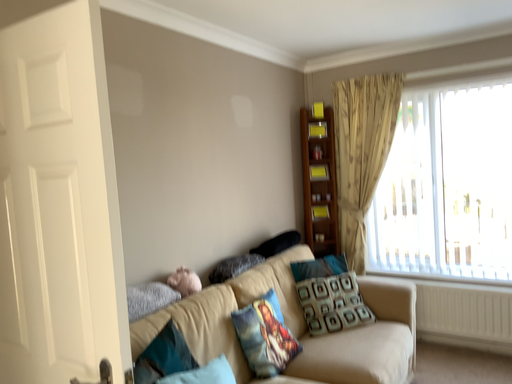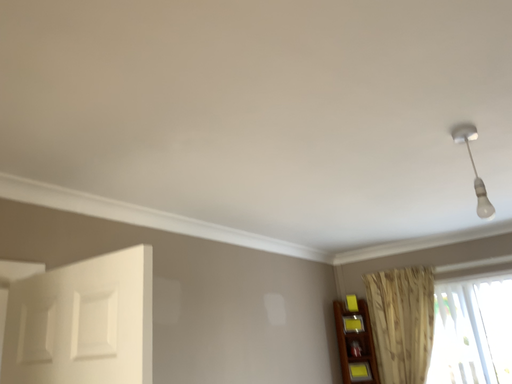
Question: How did the camera likely rotate when shooting the video?

Choices:
 (A) rotated downward
 (B) rotated upward

Answer: (B)